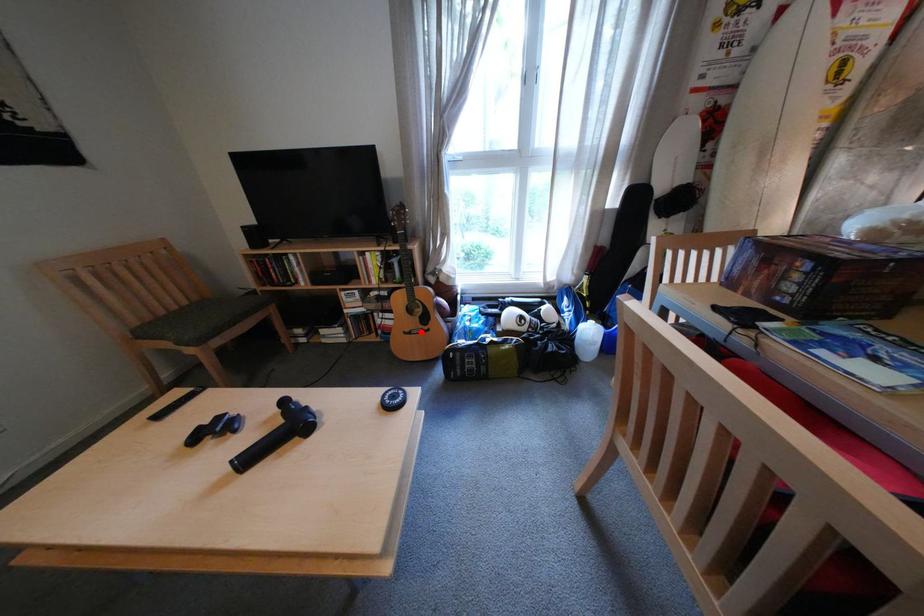
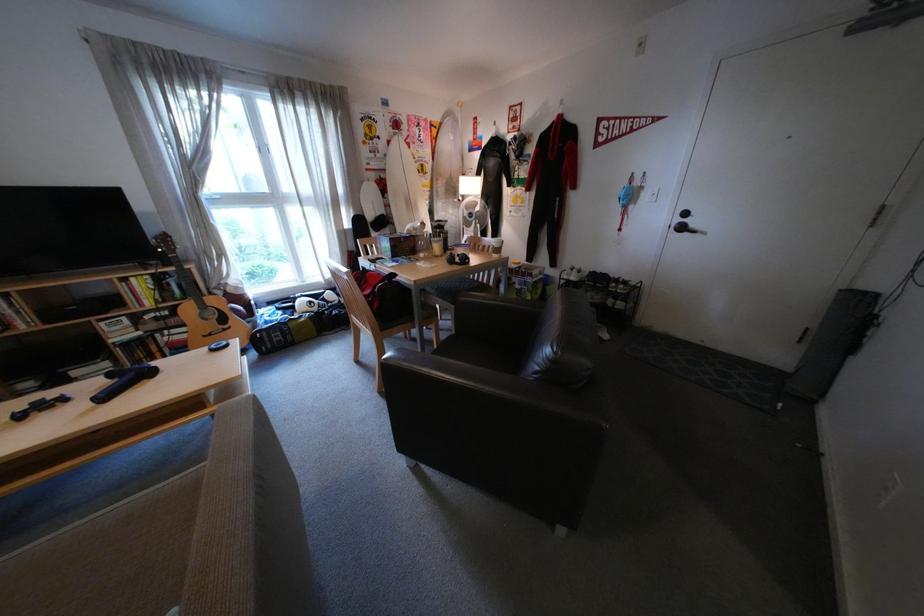
Question: I am providing you with two images of the same scene from different viewpoints. In image1, a red point is highlighted. Considering the same 3D point in image2, which of the following is correct?

Choices:
 (A) It is closer
 (B) It is farther

Answer: (A)